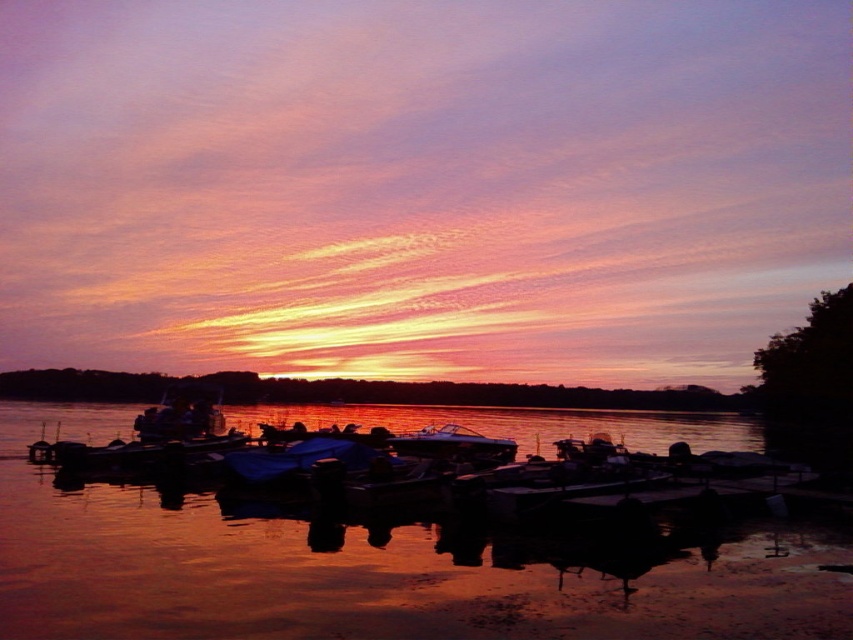
Question: Which of the following is the farthest from the observer?

Choices:
 (A) glossy white boat at center
 (B) glossy water at center

Answer: (A)

Question: Which of the following is the farthest from the observer?

Choices:
 (A) glossy white boat at center
 (B) glossy water at center

Answer: (A)

Question: Which point is closer to the camera?

Choices:
 (A) (167, 522)
 (B) (448, 433)

Answer: (A)

Question: Does glossy water at center appear under glossy white boat at center?

Choices:
 (A) yes
 (B) no

Answer: (A)

Question: Does glossy water at center lie behind glossy white boat at center?

Choices:
 (A) yes
 (B) no

Answer: (B)

Question: Is glossy water at center thinner than glossy white boat at center?

Choices:
 (A) no
 (B) yes

Answer: (A)